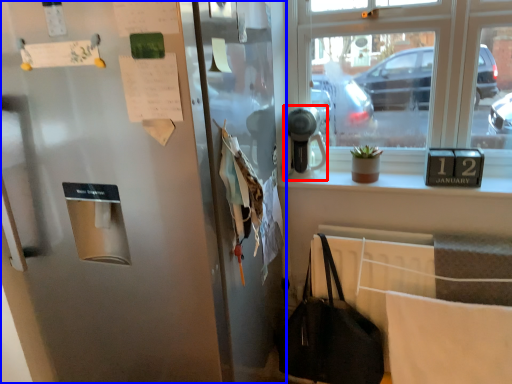
Question: Which object appears farthest to the camera in this image, appliance (highlighted by a red box) or door (highlighted by a blue box)?

Choices:
 (A) appliance
 (B) door

Answer: (A)